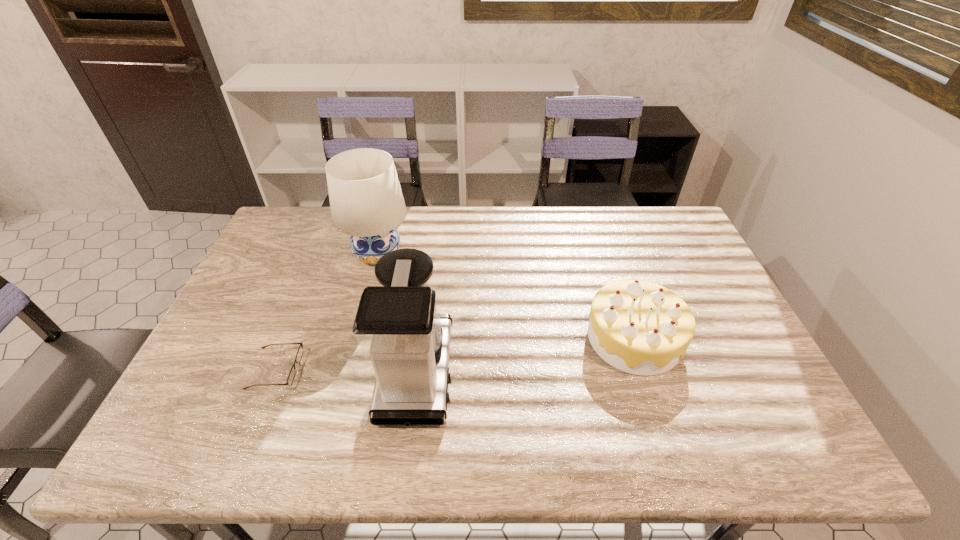
This screenshot has width=960, height=540. I want to click on vacant space that satisfies the following two spatial constraints: 1. on the front-facing side of the lampshade; 2. on the right side of the rightmost object, so point(356,338).